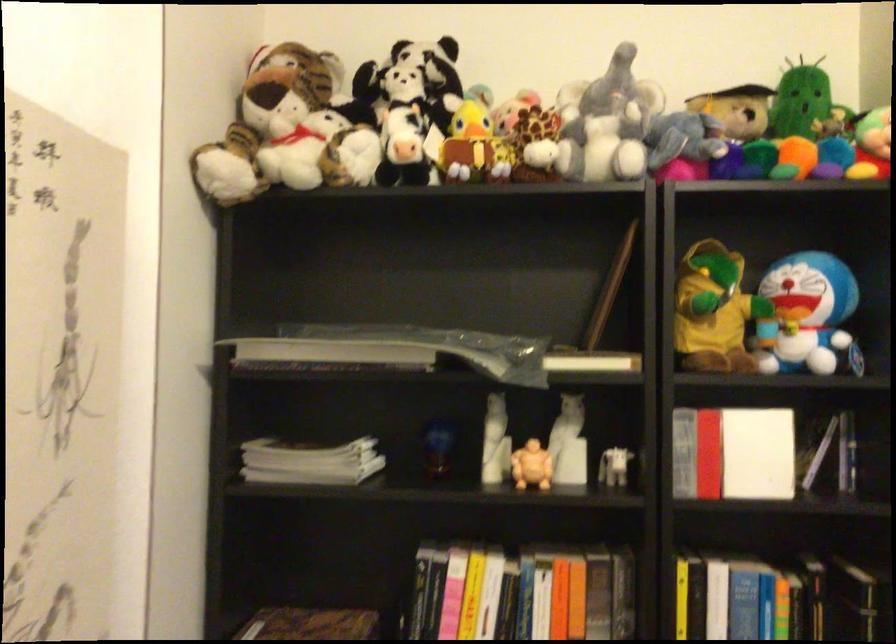
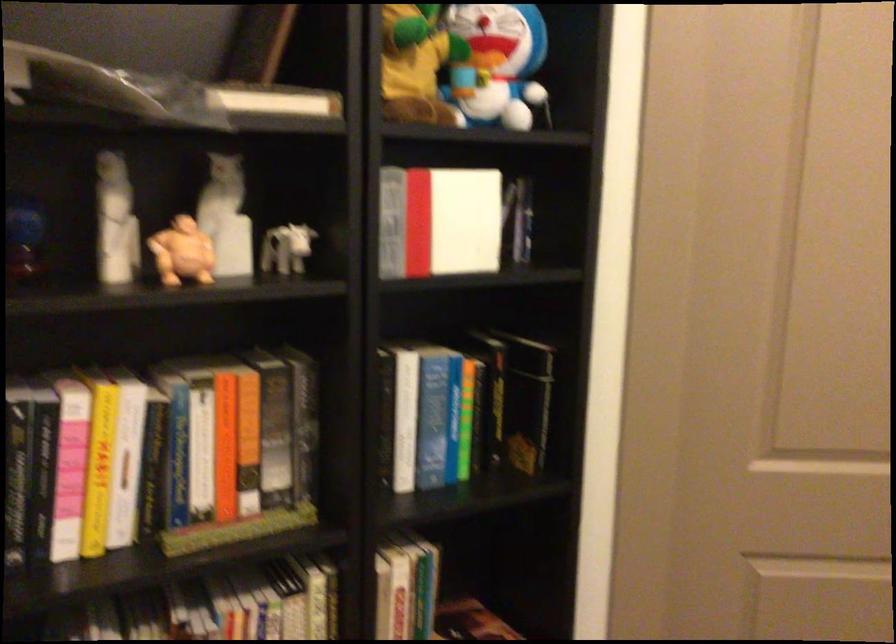
Question: The camera is either moving clockwise (left) or counter-clockwise (right) around the object. The first image is from the beginning of the video and the second image is from the end. Is the camera moving left or right when shooting the video?

Choices:
 (A) Left
 (B) Right

Answer: (A)